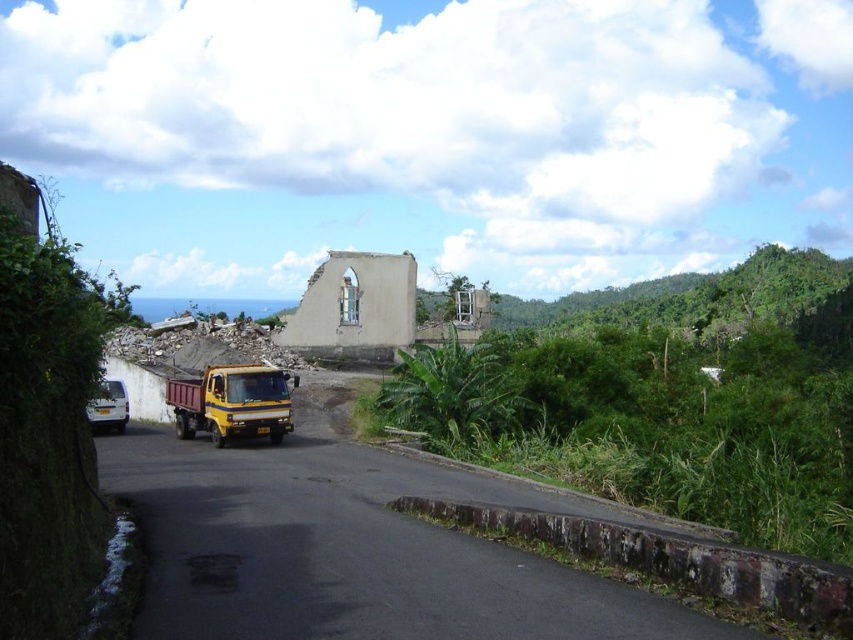
You are standing at the point closer to the camera between the two points, point (699, 323) and point (215, 365). Which point are you standing at?

You are standing at point (699, 323) because it is further to the camera than point (215, 365).

You are a delivery driver who needs to park your vehicle between the yellow matte truck at center and the white matte van at left. Given that your delivery van is 2.5 meters wide, can you fit your vehicle in the available space between them?

The yellow matte truck at center has a lesser width compared to the white matte van at left. Since the yellow matte truck at center is narrower, the space between them may be sufficient for your 2.5 meter wide delivery van. However, the exact width of the space isn not provided, so you should measure it before deciding.

Looking at this image, you are a driver approaching the white matte van at left and the green leafy vegetation at center right. Which object will you encounter first as you move forward along the road?

The green leafy vegetation at center right is closer to you than the white matte van at left, so you will encounter the green leafy vegetation at center right first.